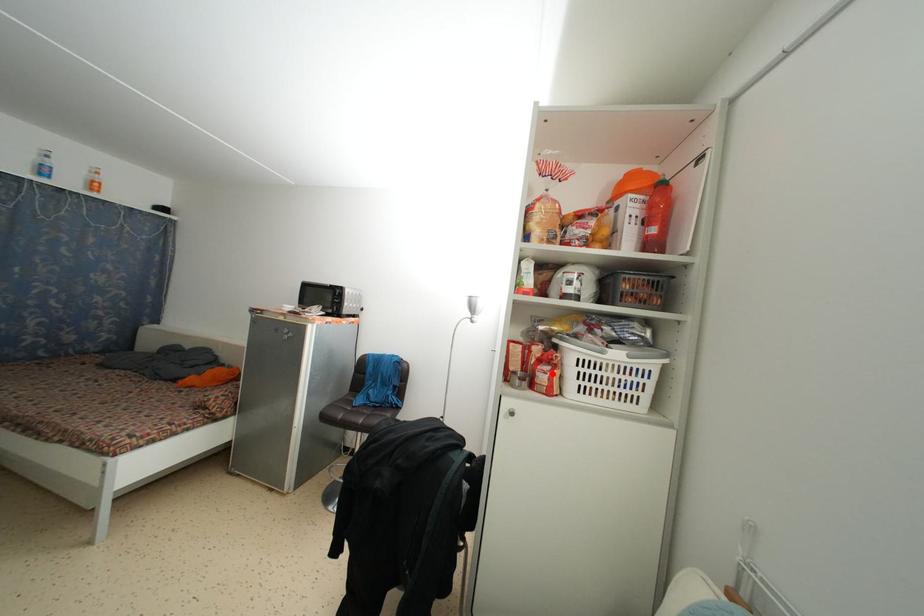
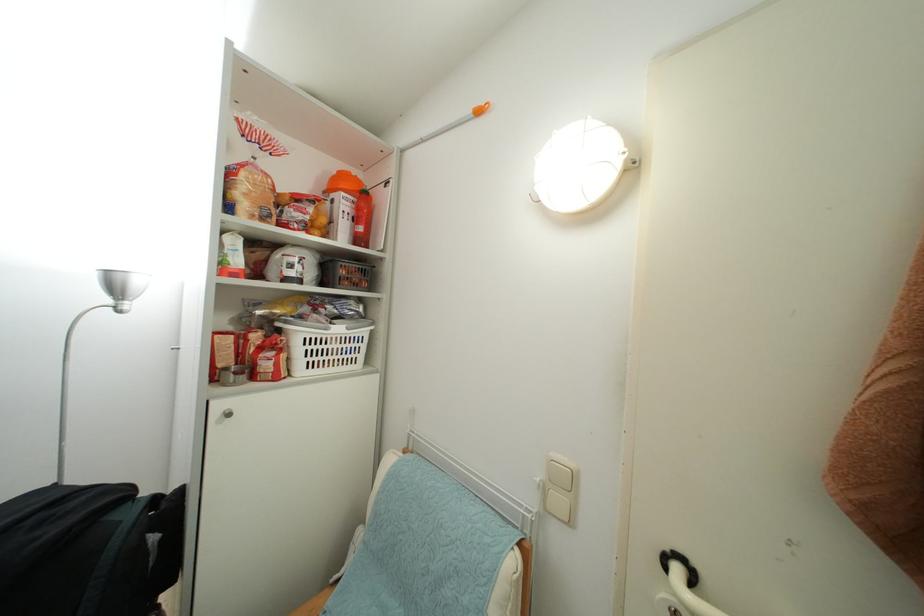
Where in the second image is the point corresponding to the highlighted location from the first image?

(276, 359)